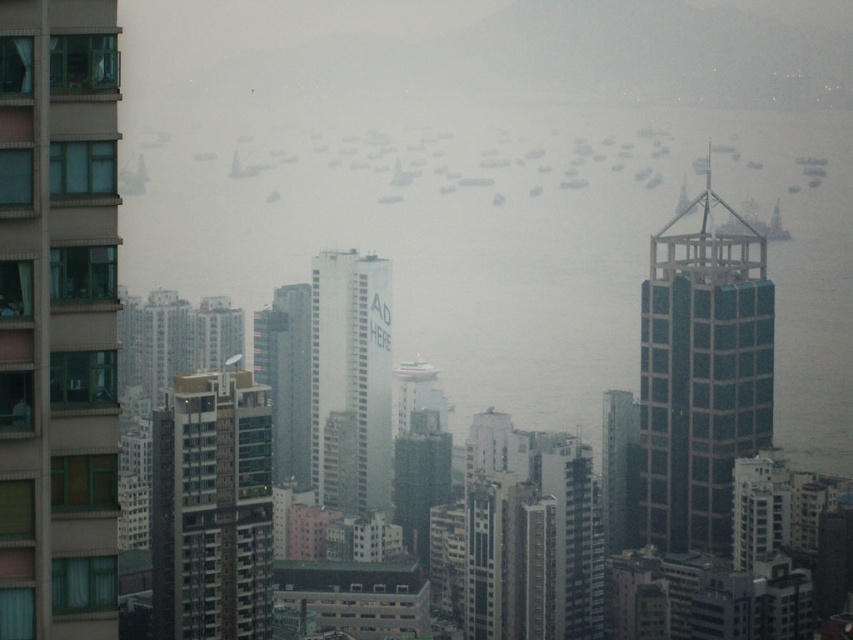
Question: Does green glass skyscraper at center right appear on the right side of white plastic boat at center?

Choices:
 (A) no
 (B) yes

Answer: (B)

Question: Does green glass skyscraper at center right appear on the left side of white matte building at center?

Choices:
 (A) no
 (B) yes

Answer: (A)

Question: Which of these objects is positioned farthest from the white matte building at center?

Choices:
 (A) brown glass windows at left
 (B) green glass skyscraper at center right

Answer: (B)

Question: Which object is positioned farthest from the foggy water at center?

Choices:
 (A) white plastic boat at center
 (B) green glass skyscraper at center right

Answer: (A)

Question: Is the position of foggy water at center less distant than that of metallic glass building at left?

Choices:
 (A) no
 (B) yes

Answer: (B)

Question: Which point is closer to the camera?

Choices:
 (A) white plastic boat at center
 (B) white matte building at center

Answer: (B)